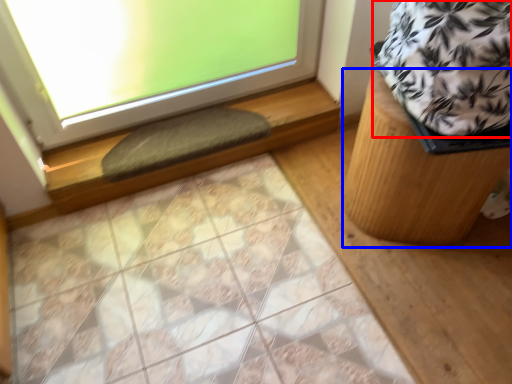
Question: Which object is further to the camera taking this photo, blanket (highlighted by a red box) or furniture (highlighted by a blue box)?

Choices:
 (A) blanket
 (B) furniture

Answer: (B)